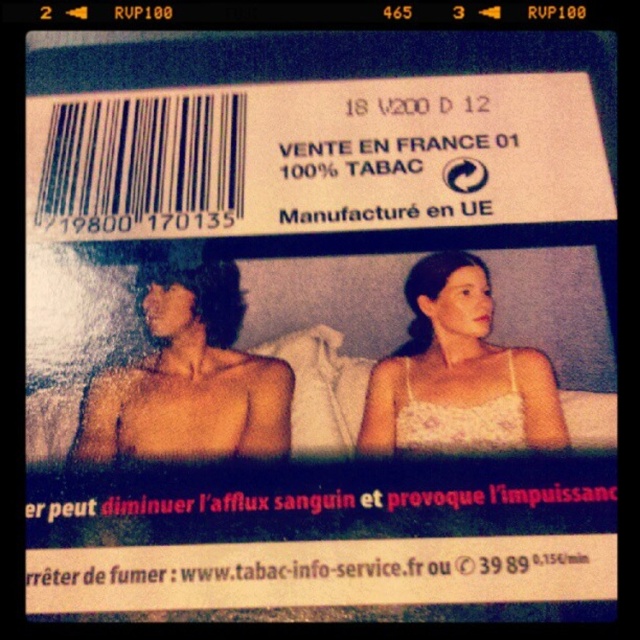
How distant is shiny skin man at center from white lace dress at center?

11.65 inches

Which is in front, point (161, 428) or point (438, 371)?

Point (161, 428) is in front.

Find the location of a particular element. The width and height of the screenshot is (640, 640). shiny skin man at center is located at coordinates (188, 378).